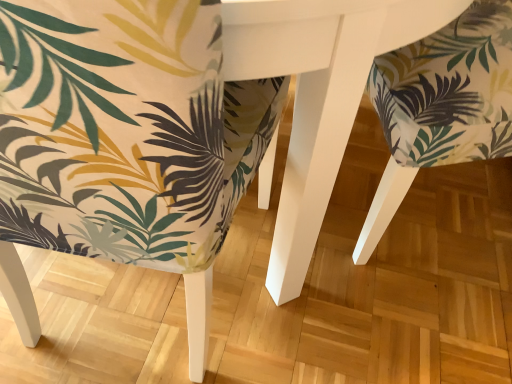
Question: In which direction should I rotate to look at printed fabric chair at center, acting as the first chair starting from the left?

Choices:
 (A) left
 (B) right

Answer: (A)

Question: Does printed fabric chair at center, acting as the first chair starting from the left, lie behind matte fabric chair at right, which is counted as the 1th chair, starting from the right?

Choices:
 (A) no
 (B) yes

Answer: (A)

Question: Could you tell me if printed fabric chair at center, arranged as the 2th chair when viewed from the right, is turned towards matte fabric chair at right, the second chair from the left?

Choices:
 (A) yes
 (B) no

Answer: (B)

Question: Is the depth of printed fabric chair at center, arranged as the 2th chair when viewed from the right, less than that of matte fabric chair at right, which is counted as the 1th chair, starting from the right?

Choices:
 (A) yes
 (B) no

Answer: (A)

Question: Does printed fabric chair at center, acting as the first chair starting from the left, have a lesser width compared to matte fabric chair at right, which is counted as the 1th chair, starting from the right?

Choices:
 (A) no
 (B) yes

Answer: (B)

Question: From the image's perspective, is printed fabric chair at center, arranged as the 2th chair when viewed from the right, over matte fabric chair at right, which is counted as the 1th chair, starting from the right?

Choices:
 (A) no
 (B) yes

Answer: (A)

Question: Is printed fabric chair at center, acting as the first chair starting from the left, beside matte fabric chair at right, which is counted as the 1th chair, starting from the right?

Choices:
 (A) no
 (B) yes

Answer: (A)

Question: Considering the relative sizes of matte fabric chair at right, the second chair from the left, and printed fabric chair at center, arranged as the 2th chair when viewed from the right, in the image provided, is matte fabric chair at right, the second chair from the left, smaller than printed fabric chair at center, arranged as the 2th chair when viewed from the right,?

Choices:
 (A) no
 (B) yes

Answer: (B)

Question: From the image's perspective, is matte fabric chair at right, which is counted as the 1th chair, starting from the right, over printed fabric chair at center, arranged as the 2th chair when viewed from the right?

Choices:
 (A) no
 (B) yes

Answer: (B)

Question: Would you say matte fabric chair at right, the second chair from the left, is outside printed fabric chair at center, arranged as the 2th chair when viewed from the right?

Choices:
 (A) no
 (B) yes

Answer: (B)

Question: Is matte fabric chair at right, which is counted as the 1th chair, starting from the right, thinner than printed fabric chair at center, acting as the first chair starting from the left?

Choices:
 (A) yes
 (B) no

Answer: (B)

Question: Can you confirm if matte fabric chair at right, which is counted as the 1th chair, starting from the right, is shorter than printed fabric chair at center, acting as the first chair starting from the left?

Choices:
 (A) yes
 (B) no

Answer: (A)

Question: Does matte fabric chair at right, the second chair from the left, lie behind printed fabric chair at center, arranged as the 2th chair when viewed from the right?

Choices:
 (A) yes
 (B) no

Answer: (A)

Question: In terms of size, does matte fabric chair at right, the second chair from the left, appear bigger or smaller than printed fabric chair at center, acting as the first chair starting from the left?

Choices:
 (A) big
 (B) small

Answer: (B)